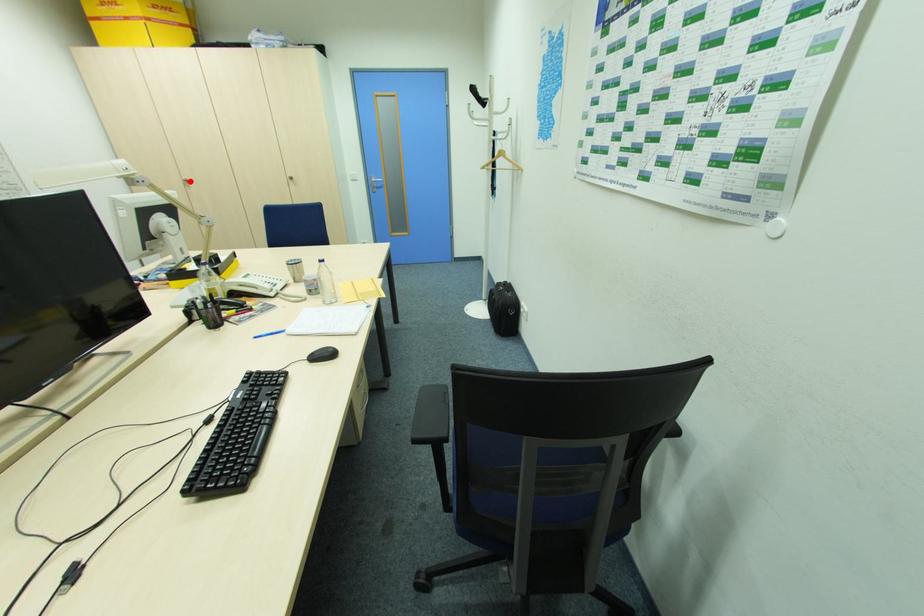
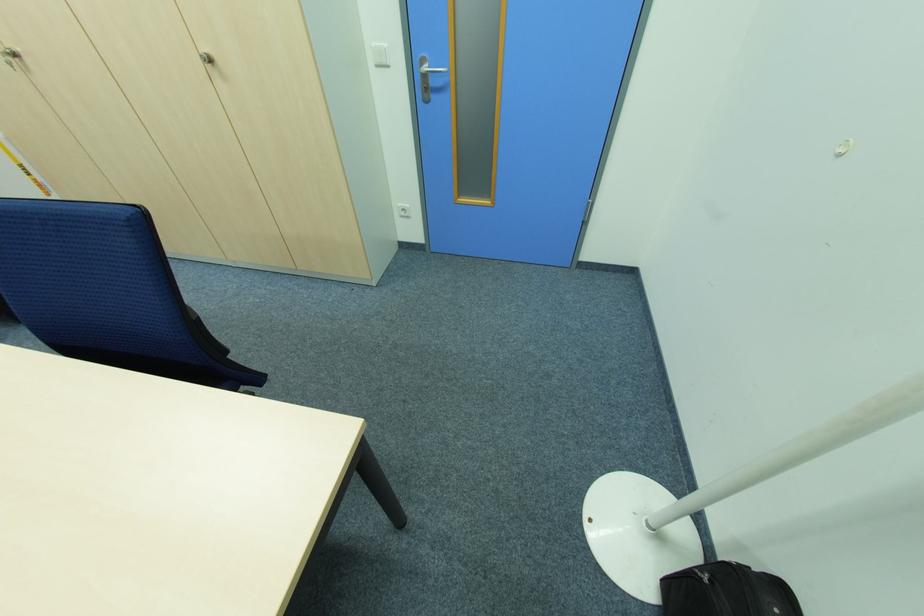
The point at the highlighted location is marked in the first image. Where is the corresponding point in the second image?

(18, 55)